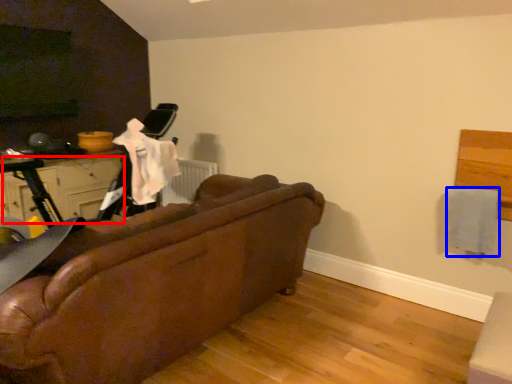
Question: Which object is closer to the camera taking this photo, drawer (highlighted by a red box) or clothe (highlighted by a blue box)?

Choices:
 (A) drawer
 (B) clothe

Answer: (B)